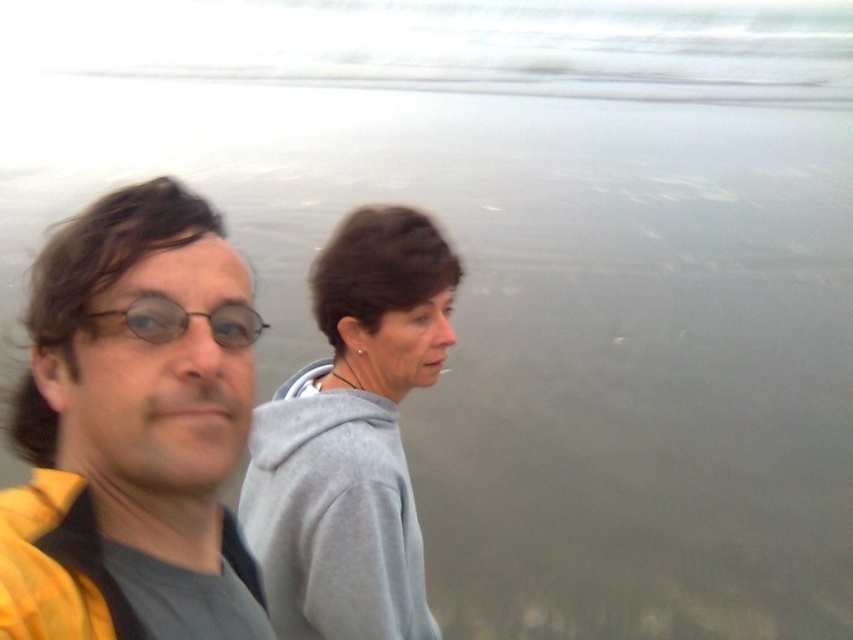
Question: Which point is closer to the camera?

Choices:
 (A) (42, 620)
 (B) (271, 531)

Answer: (A)

Question: Can you confirm if yellow fabric at left is thinner than matte black glasses at left?

Choices:
 (A) yes
 (B) no

Answer: (B)

Question: Which object is positioned closest to the matte black glasses at left?

Choices:
 (A) gray fleece at center
 (B) yellow fabric at left

Answer: (B)

Question: Can you confirm if yellow fabric at left is positioned below matte black glasses at left?

Choices:
 (A) no
 (B) yes

Answer: (B)

Question: Can you confirm if yellow fabric at left is positioned below gray fleece at center?

Choices:
 (A) yes
 (B) no

Answer: (B)

Question: Which point is closer to the camera?

Choices:
 (A) gray fleece at center
 (B) yellow fabric at left

Answer: (B)